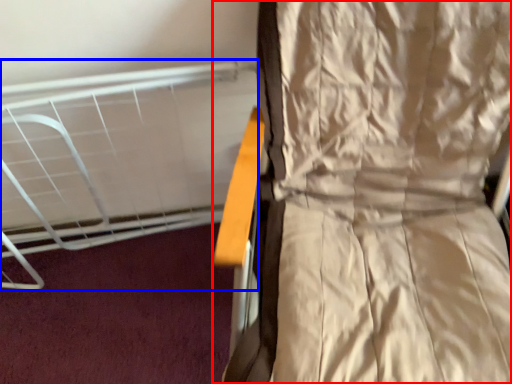
Question: Among these objects, which one is farthest to the camera, curtain (highlighted by a red box) or bed (highlighted by a blue box)?

Choices:
 (A) curtain
 (B) bed

Answer: (B)